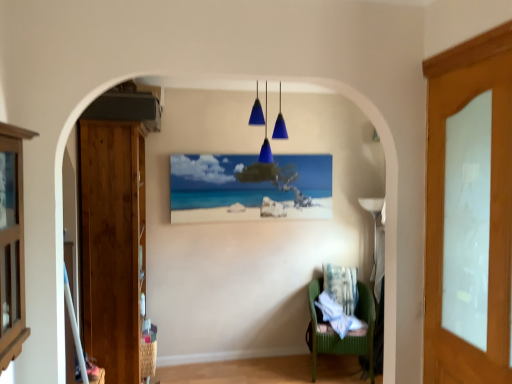
Question: In terms of height, does white glass door at right, the 1th door from the front, look taller or shorter compared to wooden cabinet at left?

Choices:
 (A) short
 (B) tall

Answer: (B)

Question: Is white glass door at right, which ranks as the second door in back-to-front order, in front of or behind wooden cabinet at left in the image?

Choices:
 (A) behind
 (B) front

Answer: (A)

Question: Estimate the real-world distances between objects in this image. Which object is closer to the blue glass pendant lights at center?

Choices:
 (A) fluffy white pillow at lower center
 (B) wooden cabinet at left
 (C) matte wooden picture frame at center
 (D) green fabric chair at lower right
 (E) wooden door at left, which is counted as the second door, starting from the front

Answer: (C)

Question: Which of these objects is positioned closest to the wooden door at left, the 1th door from the left?

Choices:
 (A) white glass door at right, which ranks as the second door in back-to-front order
 (B) blue glass pendant lights at center
 (C) green fabric chair at lower right
 (D) fluffy white pillow at lower center
 (E) wooden cabinet at left

Answer: (B)